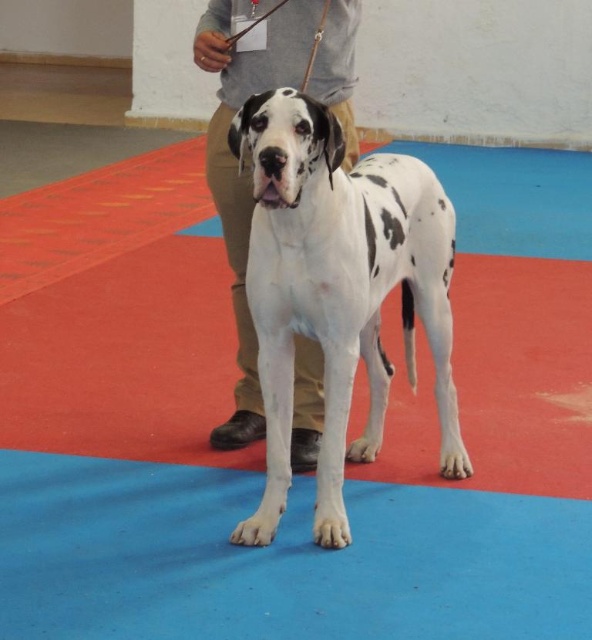
Does white-spotted fur dog at center appear under khaki pants at center?

Indeed, white-spotted fur dog at center is positioned under khaki pants at center.

Can you confirm if white-spotted fur dog at center is positioned above khaki pants at center?

No.

Is point (420, 198) more distant than point (230, 106)?

No, it is in front of (230, 106).

What are the coordinates of `white-spotted fur dog at center` in the screenshot? It's located at (339, 291).